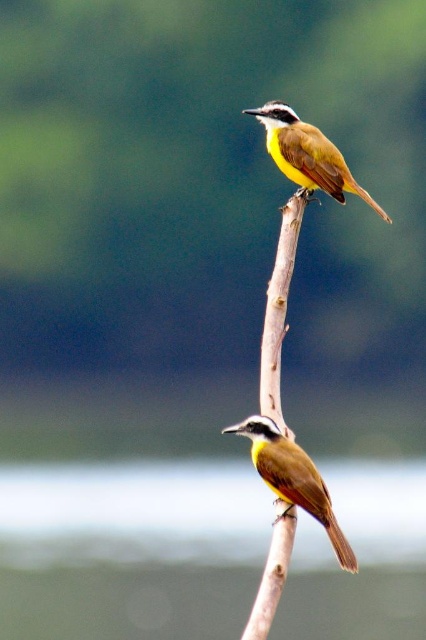
Question: Does brown matte bird at center have a larger size compared to brown feathered bird at upper center?

Choices:
 (A) no
 (B) yes

Answer: (A)

Question: Which object is farther from the camera taking this photo?

Choices:
 (A) brown wood at center
 (B) brown feathered bird at upper center

Answer: (B)

Question: Among these objects, which one is farthest from the camera?

Choices:
 (A) brown wood at center
 (B) brown feathered bird at upper center
 (C) brown matte bird at center

Answer: (B)

Question: Which point appears closest to the camera in this image?

Choices:
 (A) (299, 198)
 (B) (307, 513)
 (C) (322, 145)

Answer: (B)

Question: Can you confirm if brown wood at center is positioned to the right of brown feathered bird at upper center?

Choices:
 (A) no
 (B) yes

Answer: (A)

Question: Is brown matte bird at center to the right of brown feathered bird at upper center from the viewer's perspective?

Choices:
 (A) no
 (B) yes

Answer: (A)